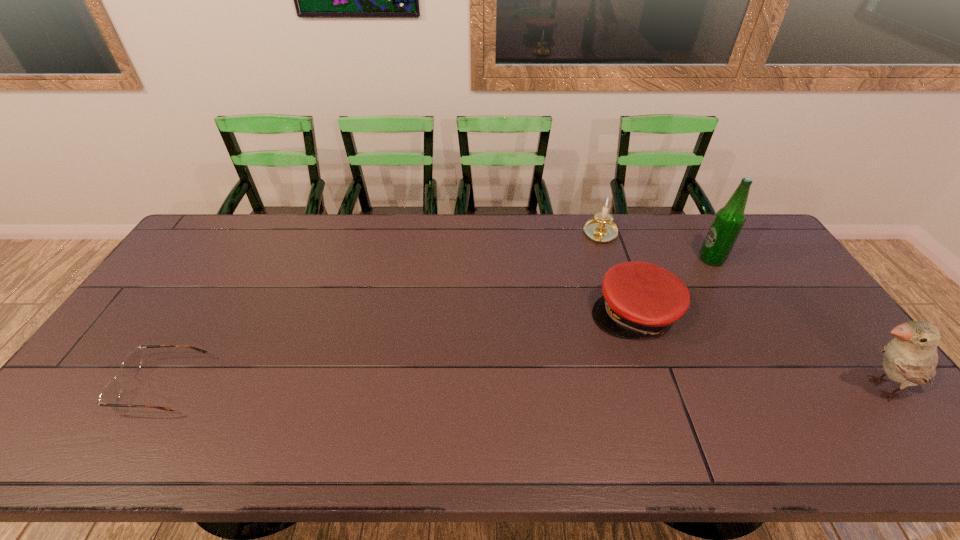
Where is `object present at the near left corner`? object present at the near left corner is located at coordinates (110, 394).

What are the coordinates of `object that is at the near right corner` in the screenshot? It's located at tap(910, 359).

In the image, there is a desktop. Identify the location of free space at the far edge. (486, 251).

I want to click on vacant space at the near edge, so click(151, 414).

At what (x,y) coordinates should I click in order to perform the action: click on blank space at the left edge of the desktop. Please return your answer as a coordinate pair (x, y). The height and width of the screenshot is (540, 960). Looking at the image, I should click on (201, 267).

This screenshot has height=540, width=960. In the image, there is a desktop. Find the location of `vacant space at the right edge`. vacant space at the right edge is located at coordinates (807, 346).

The height and width of the screenshot is (540, 960). In order to click on blank region between the candle holder and the spectacles in this screenshot , I will do `click(381, 310)`.

Locate an element on the screen. free space that is in between the tallest object and the fourth shortest object is located at coordinates (796, 324).

This screenshot has height=540, width=960. What are the coordinates of `vacant space that's between the third tallest object and the spectacles` in the screenshot? It's located at (381, 310).

I want to click on vacant area that lies between the cap and the rightmost object, so click(x=757, y=351).